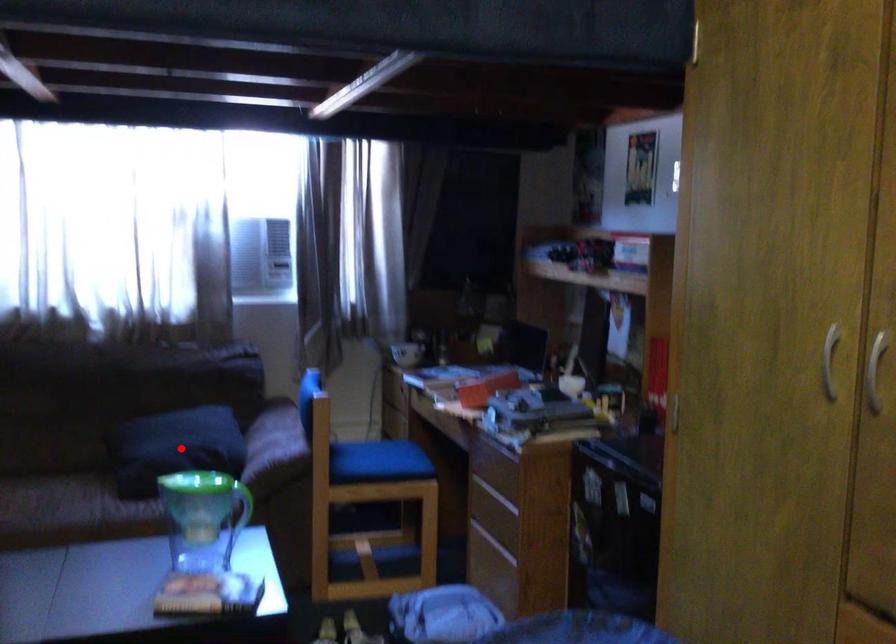
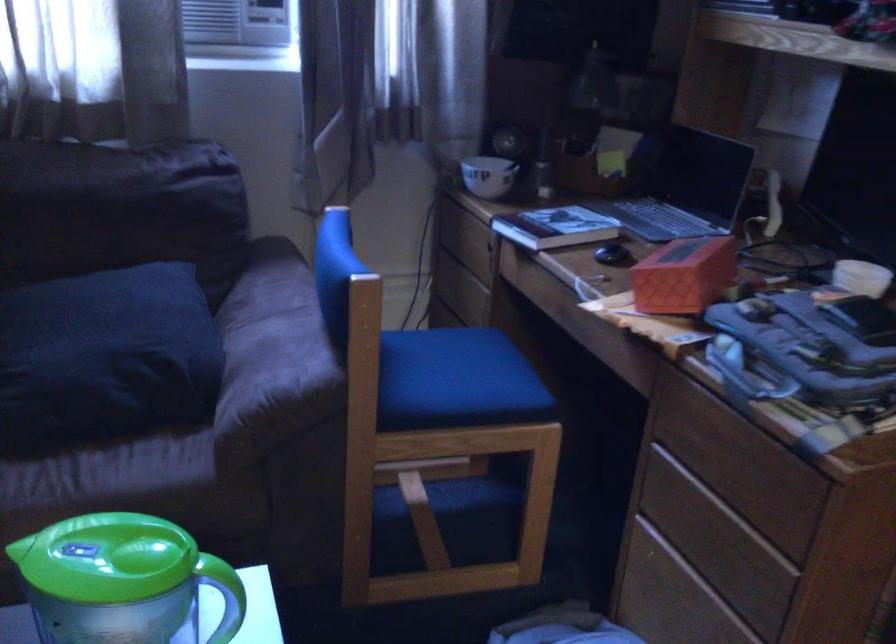
Locate, in the second image, the point that corresponds to the highlighted location in the first image.

(106, 357)